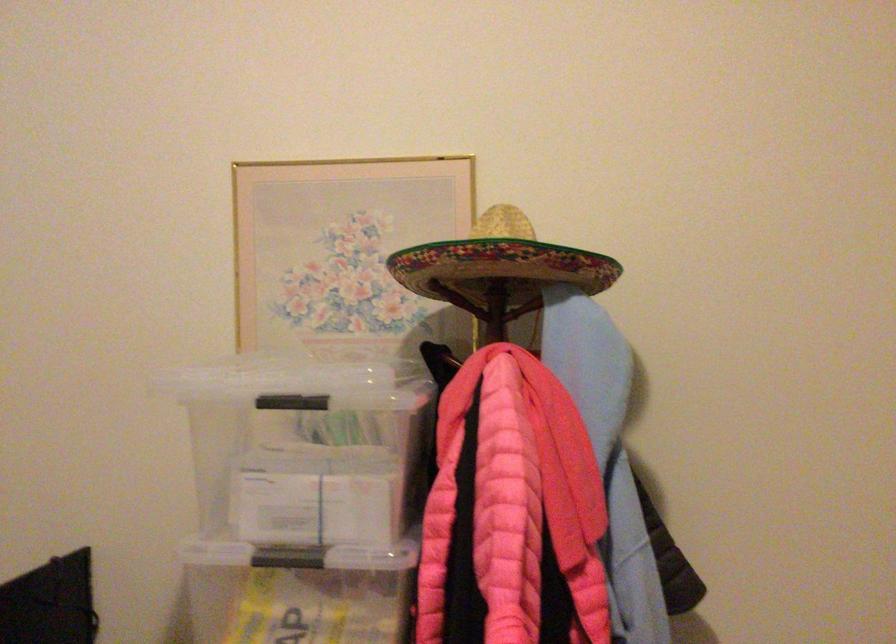
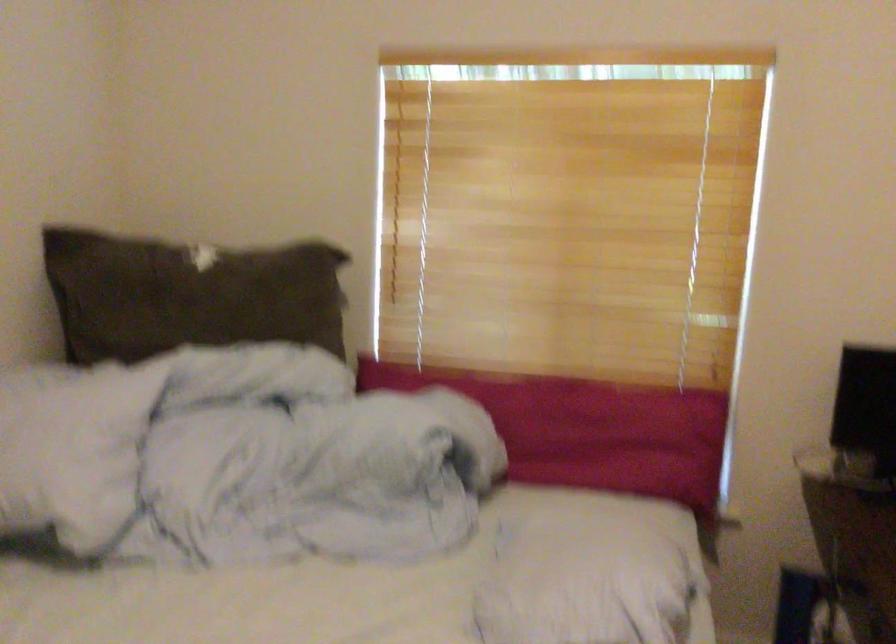
Question: The camera is either moving clockwise (left) or counter-clockwise (right) around the object. The first image is from the beginning of the video and the second image is from the end. Is the camera moving left or right when shooting the video?

Choices:
 (A) Left
 (B) Right

Answer: (B)